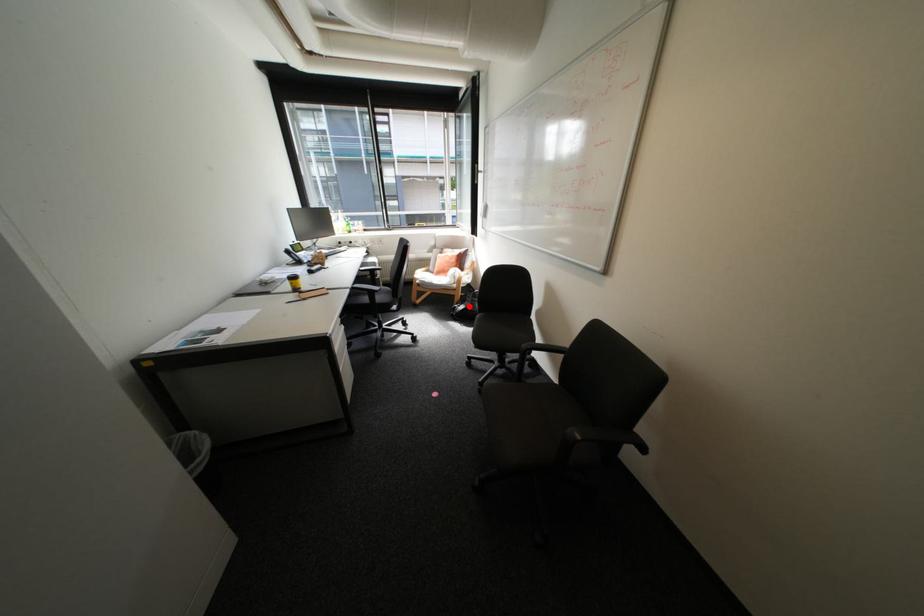
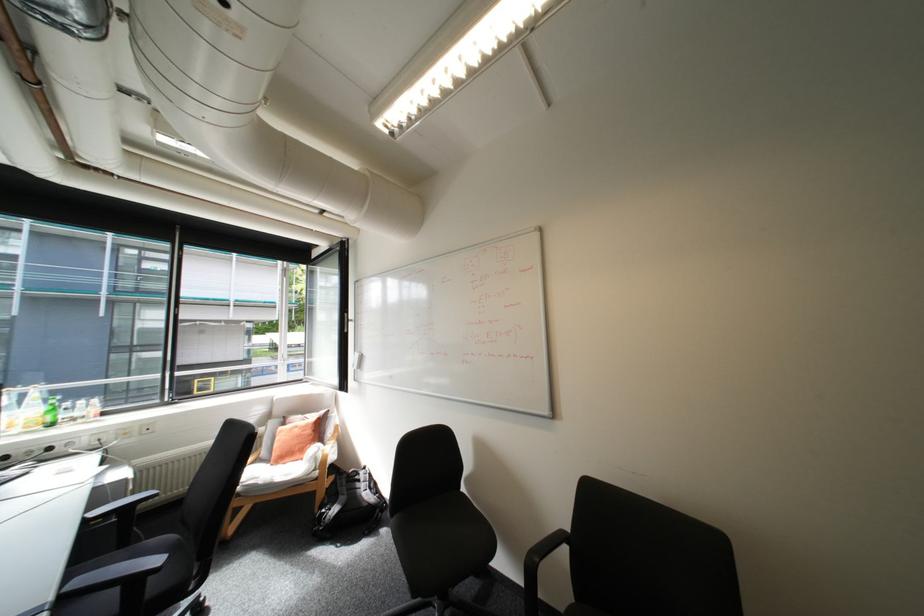
Where in the second image is the point corresponding to the highlighted location from the first image?

(339, 509)